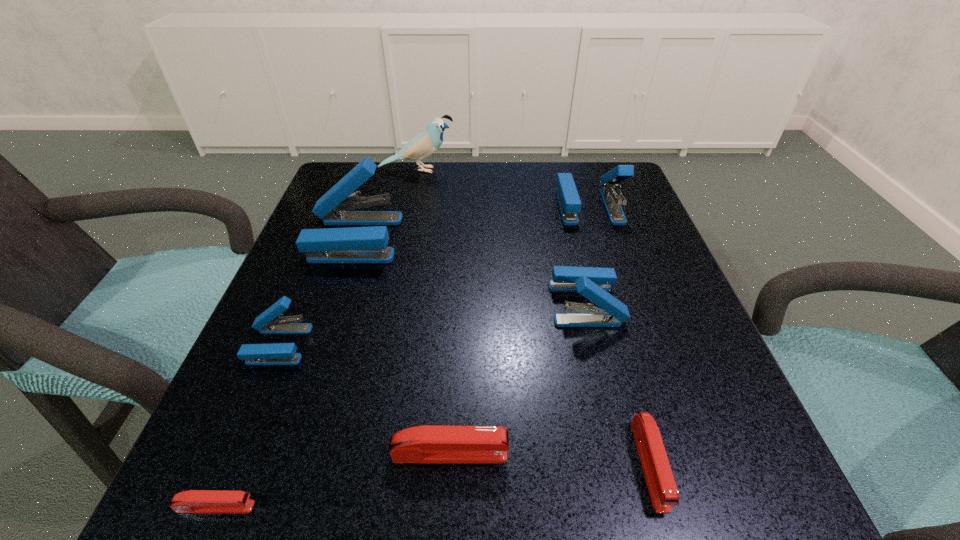
Where is `vacant region at the left edge of the desktop`? The image size is (960, 540). vacant region at the left edge of the desktop is located at coordinates (285, 335).

In the image, there is a desktop. At what (x,y) coordinates should I click in order to perform the action: click on vacant space at the right edge. Please return your answer as a coordinate pair (x, y). The height and width of the screenshot is (540, 960). Looking at the image, I should click on (665, 249).

The height and width of the screenshot is (540, 960). What are the coordinates of `vacant space at the near left corner of the desktop` in the screenshot? It's located at (283, 488).

Image resolution: width=960 pixels, height=540 pixels. In the image, there is a desktop. What are the coordinates of `free region at the far right corner` in the screenshot? It's located at (570, 162).

Where is `vacant point located between the biggest red stapler and the bird`? This screenshot has height=540, width=960. vacant point located between the biggest red stapler and the bird is located at coordinates (433, 312).

The width and height of the screenshot is (960, 540). I want to click on vacant region between the third shortest object and the third biggest blue stapler, so click(517, 379).

Locate an element on the screen. Image resolution: width=960 pixels, height=540 pixels. free space between the third tallest stapler and the second tallest stapler is located at coordinates (588, 255).

Find the location of `free space between the fourth stapler from left to right and the smallest blue stapler`. free space between the fourth stapler from left to right and the smallest blue stapler is located at coordinates (364, 399).

Locate an element on the screen. free space between the smallest blue stapler and the tallest stapler is located at coordinates (317, 291).

Where is `vacant region between the second red stapler from right to left and the shortest object`? vacant region between the second red stapler from right to left and the shortest object is located at coordinates (333, 480).